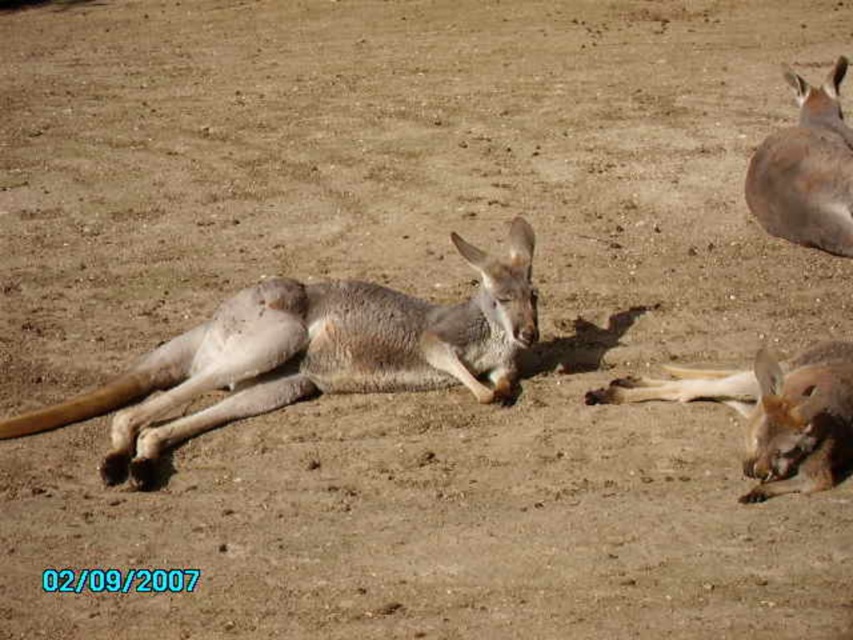
You are a wildlife photographer trying to capture a clear photo of the light brown fur kangaroo at center and the light brown fur at lower right. Which one is closer to the camera?

The light brown fur kangaroo at center is positioned over light brown fur at lower right, meaning it is closer to the camera.

You are a wildlife photographer aiming to capture a closeup of the light brown fur at lower right. Your camera has a minimum focusing distance of 4 meters. Can you take the photo without moving closer than 4 meters?

The light brown fur at lower right is 4.39 meters from the viewer. Since the minimum focusing distance is 4 meters, you can take the photo without moving closer because the distance is sufficient.